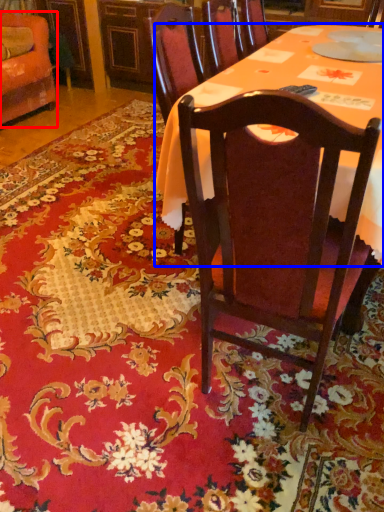
Question: Which point is further to the camera, chair (highlighted by a red box) or desk (highlighted by a blue box)?

Choices:
 (A) chair
 (B) desk

Answer: (A)